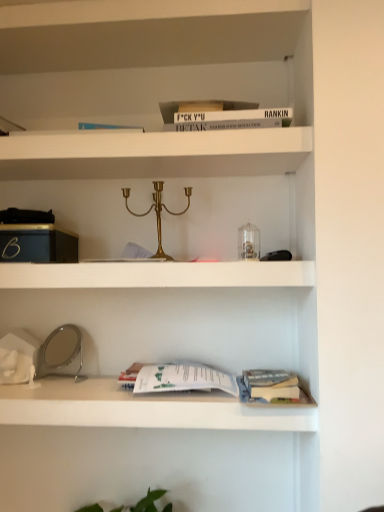
Question: Which direction should I rotate to look at white matte shelf at upper center, placed as the 1th shelf when sorted from top to bottom?

Choices:
 (A) right
 (B) left

Answer: (B)

Question: From a real-world perspective, is white matte shelf at upper center, placed as the 1th shelf when sorted from top to bottom, positioned under white matte shelf at center based on gravity?

Choices:
 (A) yes
 (B) no

Answer: (B)

Question: Considering the relative sizes of white matte shelf at upper center, which is the second shelf in bottom-to-top order, and white matte shelf at center in the image provided, is white matte shelf at upper center, which is the second shelf in bottom-to-top order, shorter than white matte shelf at center?

Choices:
 (A) yes
 (B) no

Answer: (A)

Question: Is white matte shelf at upper center, which is the second shelf in bottom-to-top order, closer to camera compared to white matte shelf at center?

Choices:
 (A) no
 (B) yes

Answer: (A)

Question: Does white matte shelf at upper center, placed as the 1th shelf when sorted from top to bottom, have a smaller size compared to white matte shelf at center?

Choices:
 (A) yes
 (B) no

Answer: (A)

Question: From the image's perspective, would you say white matte shelf at upper center, which is the second shelf in bottom-to-top order, is positioned over white matte shelf at center?

Choices:
 (A) yes
 (B) no

Answer: (A)

Question: Is white matte shelf at upper center, placed as the 1th shelf when sorted from top to bottom, facing away from white matte shelf at center?

Choices:
 (A) yes
 (B) no

Answer: (B)

Question: Considering the relative sizes of white paper at lower center, positioned as the second shelf in top-to-bottom order, and white matte shelf at upper center, which is the second shelf in bottom-to-top order, in the image provided, is white paper at lower center, positioned as the second shelf in top-to-bottom order, shorter than white matte shelf at upper center, which is the second shelf in bottom-to-top order,?

Choices:
 (A) yes
 (B) no

Answer: (B)

Question: Is white paper at lower center, which is counted as the first shelf, starting from the bottom, thinner than white matte shelf at upper center, placed as the 1th shelf when sorted from top to bottom?

Choices:
 (A) no
 (B) yes

Answer: (B)

Question: Is white paper at lower center, which is counted as the first shelf, starting from the bottom, in front of white matte shelf at upper center, placed as the 1th shelf when sorted from top to bottom?

Choices:
 (A) no
 (B) yes

Answer: (B)

Question: Can you confirm if white paper at lower center, positioned as the second shelf in top-to-bottom order, is wider than white matte shelf at upper center, placed as the 1th shelf when sorted from top to bottom?

Choices:
 (A) yes
 (B) no

Answer: (B)

Question: Does white paper at lower center, positioned as the second shelf in top-to-bottom order, turn towards white matte shelf at upper center, placed as the 1th shelf when sorted from top to bottom?

Choices:
 (A) yes
 (B) no

Answer: (B)

Question: Does white paper at lower center, which is counted as the first shelf, starting from the bottom, touch white matte shelf at upper center, which is the second shelf in bottom-to-top order?

Choices:
 (A) yes
 (B) no

Answer: (B)

Question: Does white matte shelf at center turn towards white matte shelf at upper center, which is the second shelf in bottom-to-top order?

Choices:
 (A) yes
 (B) no

Answer: (B)